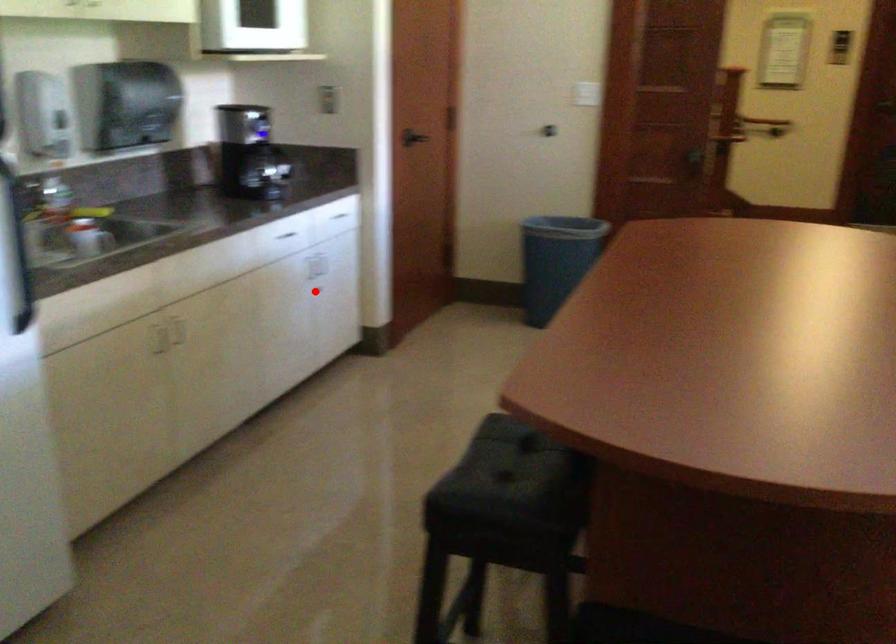
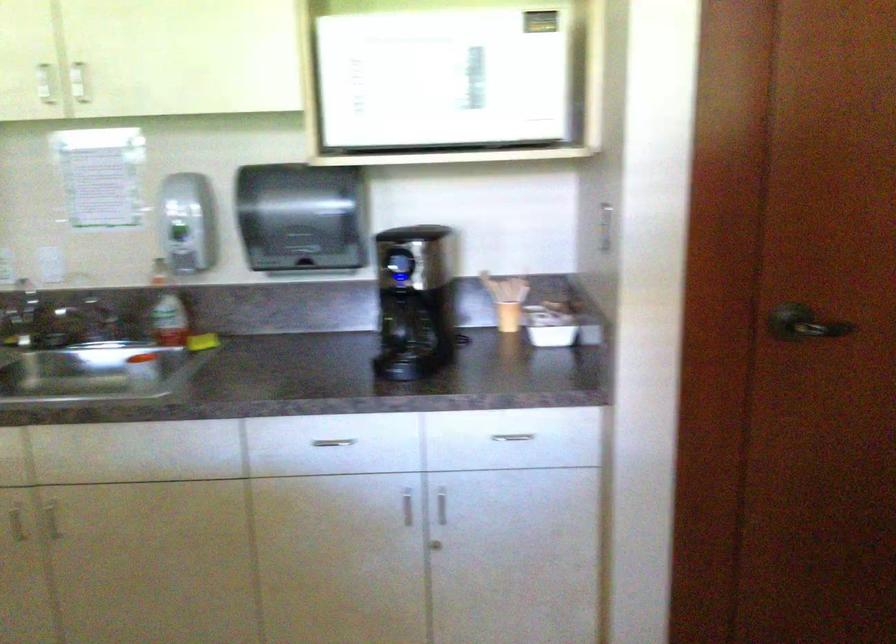
Question: I am providing you with two images of the same scene from different viewpoints. A red point is shown in image1. For the corresponding object point in image2, is it positioned nearer or farther from the camera?

Choices:
 (A) Nearer
 (B) Farther

Answer: (A)